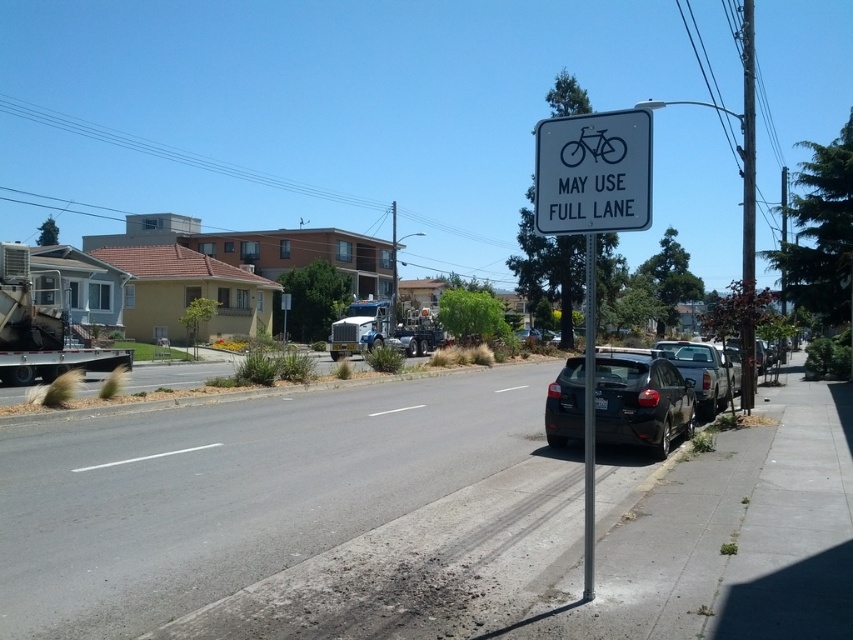
Looking at this image, is white plastic sign at upper center positioned at the back of shiny black sedan at center-right?

Yes, white plastic sign at upper center is behind shiny black sedan at center-right.

In the scene shown: Is white plastic sign at upper center taller than shiny black sedan at center-right?

Yes, white plastic sign at upper center is taller than shiny black sedan at center-right.

Is point (598, 205) in front of point (665, 388)?

Yes, it is.

I want to click on white plastic sign at upper center, so click(593, 172).

Is point (595, 440) behind point (686, 360)?

No, (595, 440) is closer to viewer.

Is black metal pole at center below silver metallic truck at right?

Incorrect, black metal pole at center is not positioned below silver metallic truck at right.

Image resolution: width=853 pixels, height=640 pixels. What do you see at coordinates (589, 420) in the screenshot?
I see `black metal pole at center` at bounding box center [589, 420].

Find the location of a particular element. This screenshot has width=853, height=640. black metal pole at center is located at coordinates (589, 420).

Consider the image. Which of these two, white plastic sign at upper center or metallic gray pole at right, stands shorter?

white plastic sign at upper center is shorter.

Is white plastic sign at upper center wider than metallic gray pole at right?

Incorrect, white plastic sign at upper center's width does not surpass metallic gray pole at right's.

Is point (647, 216) less distant than point (746, 128)?

Yes, point (647, 216) is closer to viewer.

Find the location of a particular element. white plastic sign at upper center is located at coordinates (593, 172).